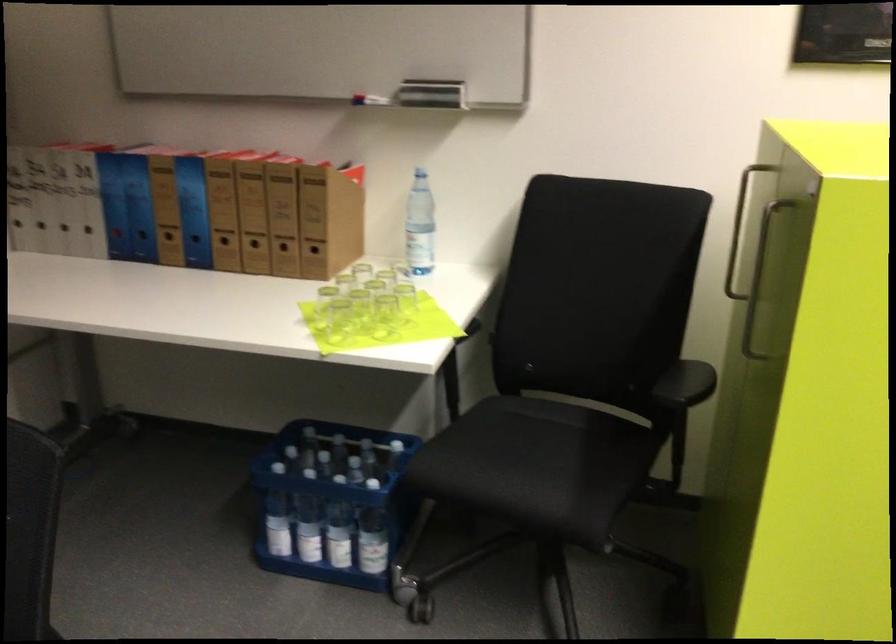
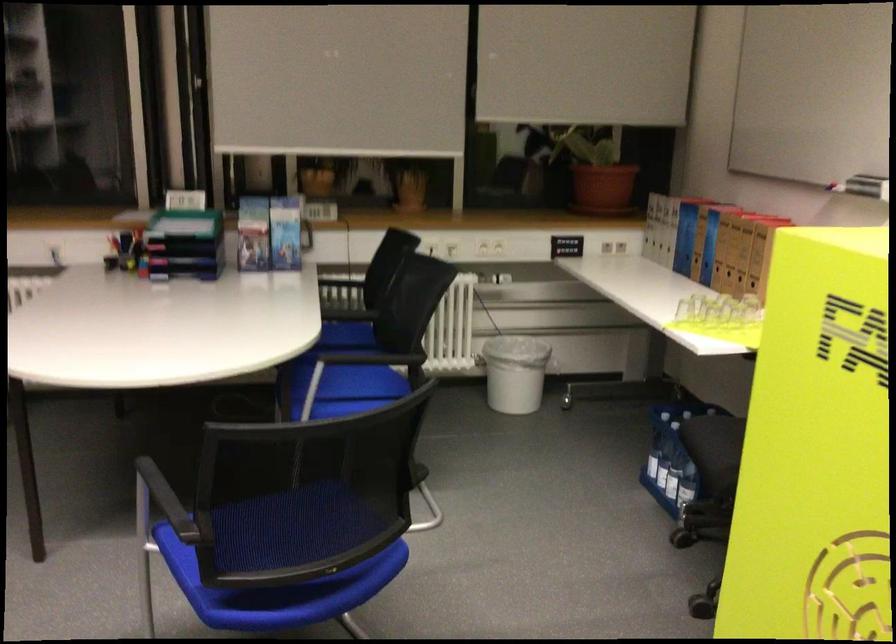
Find the pixel in the second image that matches point 323,536 in the first image.

(667, 471)